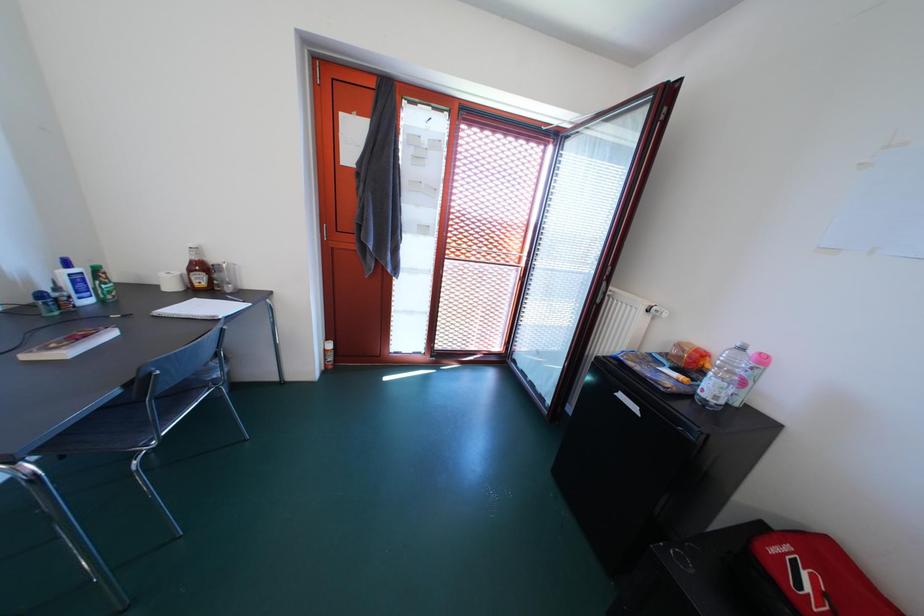
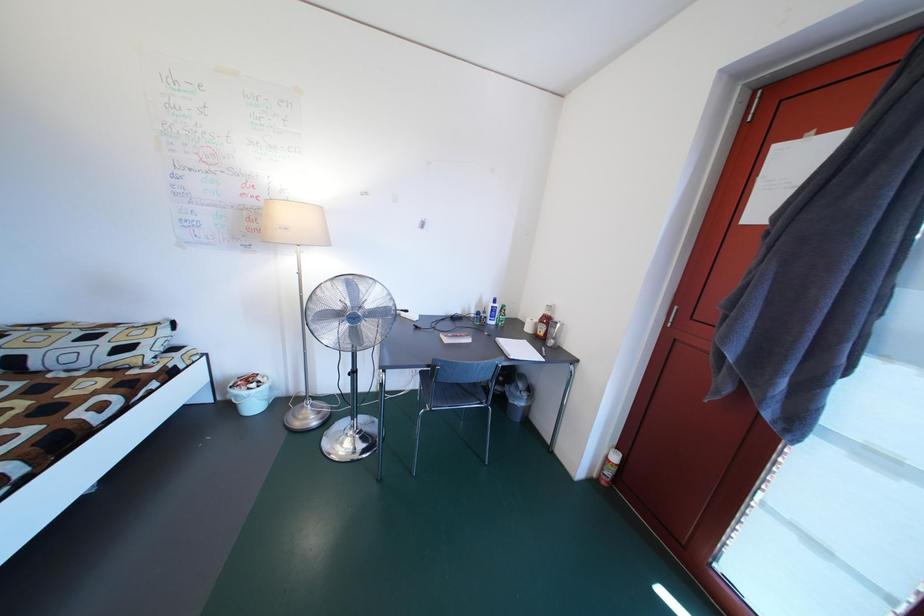
Question: The camera is either moving clockwise (left) or counter-clockwise (right) around the object. The first image is from the beginning of the video and the second image is from the end. Is the camera moving left or right when shooting the video?

Choices:
 (A) Left
 (B) Right

Answer: (B)